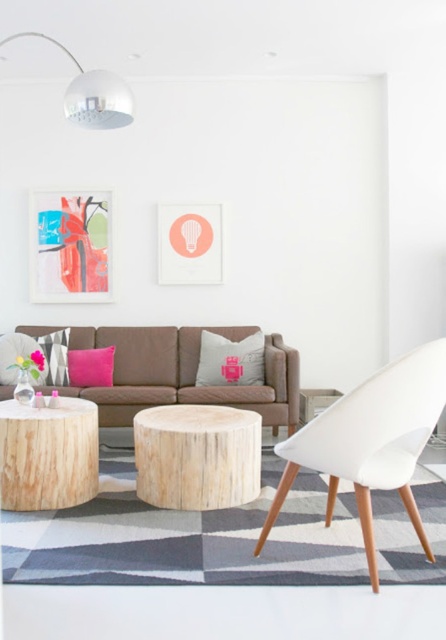
Question: Is gray fabric pillow at center thinner than pink fabric pillow at center?

Choices:
 (A) no
 (B) yes

Answer: (A)

Question: Does natural wood side table at center have a larger size compared to pink fabric pillow at center?

Choices:
 (A) no
 (B) yes

Answer: (B)

Question: Which object appears closest to the camera in this image?

Choices:
 (A) pink fabric pillow at center
 (B) brown fabric couch at center

Answer: (B)

Question: Among these objects, which one is farthest from the camera?

Choices:
 (A) natural wood side table at lower left
 (B) gray fabric pillow at center

Answer: (B)

Question: Which object appears closest to the camera in this image?

Choices:
 (A) pink fabric pillow at center
 (B) gray fabric pillow at center
 (C) natural wood side table at lower left
 (D) white matte chair at center

Answer: (D)

Question: Does natural wood side table at lower left appear on the left side of gray fabric pillow at center?

Choices:
 (A) no
 (B) yes

Answer: (B)